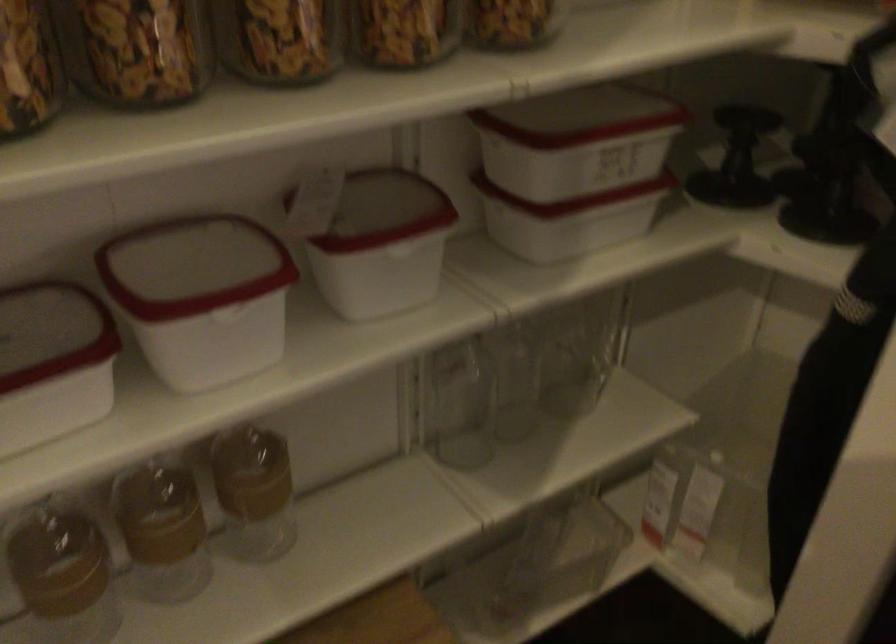
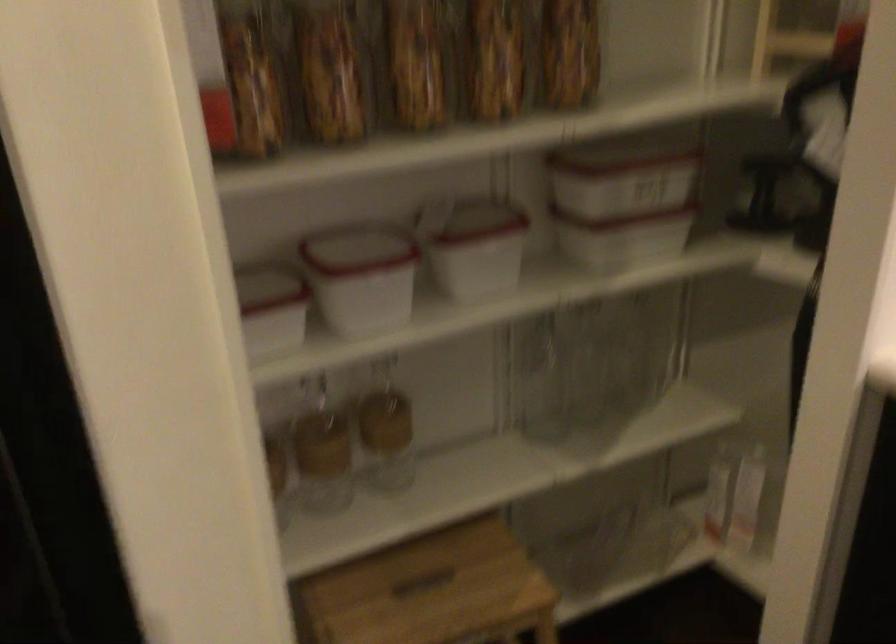
Question: The camera is either moving clockwise (left) or counter-clockwise (right) around the object. The first image is from the beginning of the video and the second image is from the end. Is the camera moving left or right when shooting the video?

Choices:
 (A) Left
 (B) Right

Answer: (B)